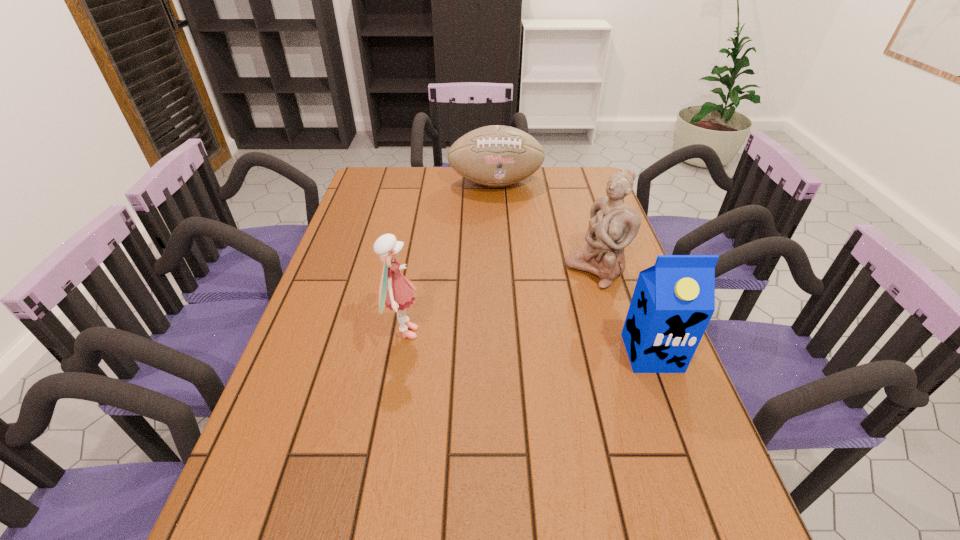
Find the location of a particular element. blank space located on the front-facing side of the second farthest object is located at coordinates (509, 326).

Locate an element on the screen. vacant space situated 0.070m on the front-facing side of the second farthest object is located at coordinates (559, 294).

Locate an element on the screen. vacant space positioned 0.190m on the front-facing side of the second farthest object is located at coordinates [528, 314].

Where is `object located in the far edge section of the desktop`? object located in the far edge section of the desktop is located at coordinates (496, 156).

Locate an element on the screen. carton present at the right edge is located at coordinates (673, 301).

Where is `figurine that is positioned at the right edge`? This screenshot has height=540, width=960. figurine that is positioned at the right edge is located at coordinates (613, 225).

The height and width of the screenshot is (540, 960). Find the location of `free space at the far edge`. free space at the far edge is located at coordinates (461, 183).

The width and height of the screenshot is (960, 540). Identify the location of vacant space at the left edge. (353, 248).

The image size is (960, 540). I want to click on vacant region at the right edge of the desktop, so click(627, 266).

Locate an element on the screen. free region at the far left corner of the desktop is located at coordinates (383, 186).